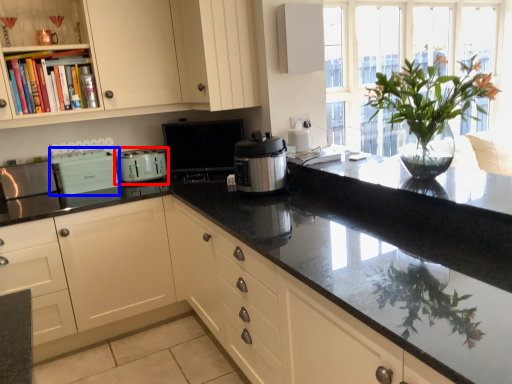
Question: Which object appears closest to the camera in this image, kitchen appliance (highlighted by a red box) or appliance (highlighted by a blue box)?

Choices:
 (A) kitchen appliance
 (B) appliance

Answer: (B)